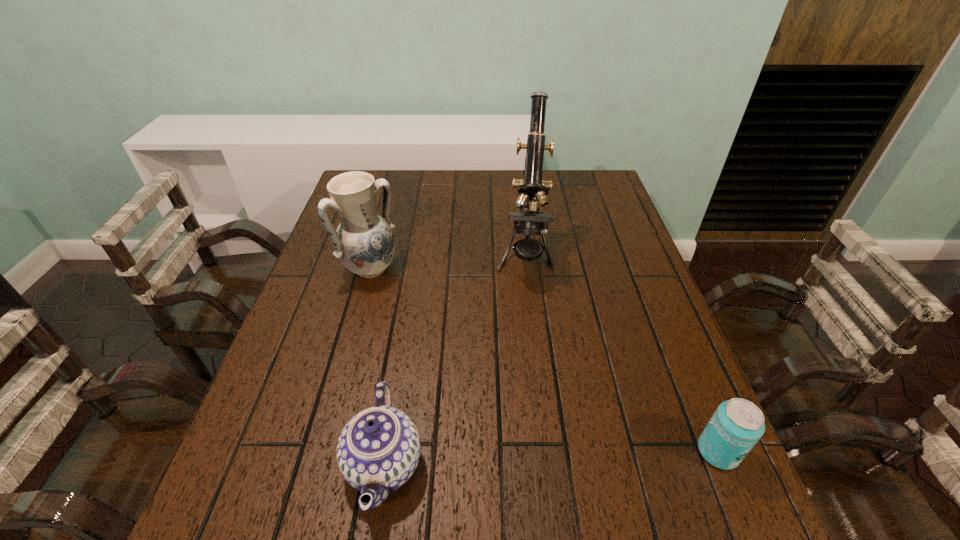
This screenshot has width=960, height=540. What are the coordinates of `vacant area that lies between the microscope and the chinaware` in the screenshot? It's located at [x=454, y=359].

Where is `unoccupied area between the microscope and the chinaware`? Image resolution: width=960 pixels, height=540 pixels. unoccupied area between the microscope and the chinaware is located at coordinates pyautogui.click(x=454, y=359).

The height and width of the screenshot is (540, 960). I want to click on free space between the second tallest object and the chinaware, so click(377, 367).

The image size is (960, 540). Identify the location of free space between the chinaware and the beer can. (551, 458).

Find the location of a particular element. The width and height of the screenshot is (960, 540). free space between the microscope and the second tallest object is located at coordinates (447, 261).

The image size is (960, 540). Find the location of `vacant area between the rightmost object and the pottery`. vacant area between the rightmost object and the pottery is located at coordinates (544, 360).

I want to click on blank region between the third object from left to right and the pottery, so click(x=447, y=261).

Choose which object is the nearest neighbor to the pottery. Please provide its 2D coordinates. Your answer should be formatted as a tuple, i.e. [(x, y)], where the tuple contains the x and y coordinates of a point satisfying the conditions above.

[(532, 189)]

Identify the location of object that can be found as the closest to the second tallest object. (532, 189).

The height and width of the screenshot is (540, 960). Find the location of `vacant position in the image that satisfies the following two spatial constraints: 1. on the front side of the beer can; 2. on the right side of the third object from left to right`. vacant position in the image that satisfies the following two spatial constraints: 1. on the front side of the beer can; 2. on the right side of the third object from left to right is located at coordinates (547, 451).